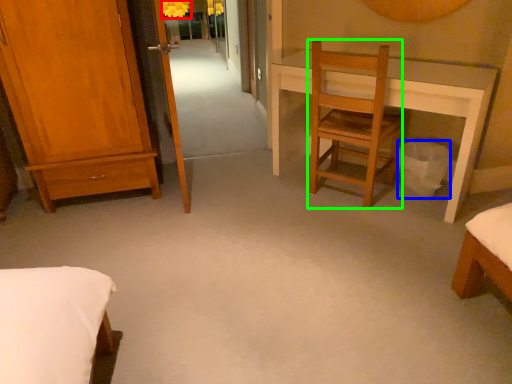
Question: Which object is the closest to the lamp (highlighted by a red box)? Choose among these: trash bin/can (highlighted by a blue box) or chair (highlighted by a green box).

Choices:
 (A) trash bin/can
 (B) chair

Answer: (B)